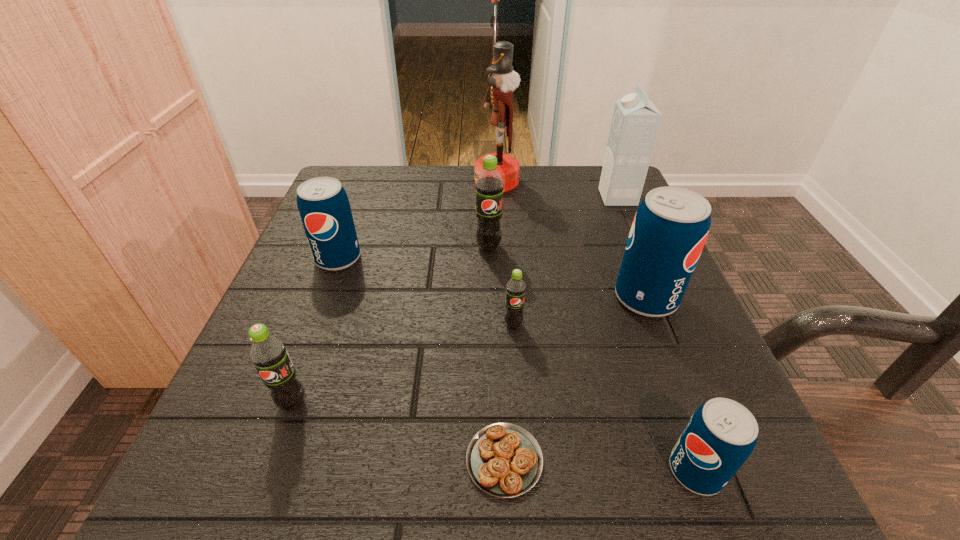
This screenshot has height=540, width=960. What are the coordinates of `pop that stands as the third closest to the farthest green soda` in the screenshot? It's located at (324, 208).

Where is `the second closest blue pop to the second tallest object`? the second closest blue pop to the second tallest object is located at coordinates (324, 208).

Identify the location of the second closest blue pop to the red nutcracker. (670, 228).

What are the coordinates of `green soda identified as the second closest to the second smallest blue pop` in the screenshot? It's located at (268, 353).

Identify which green soda is located as the third nearest to the pastry. Please provide its 2D coordinates. Your answer should be formatted as a tuple, i.e. [(x, y)], where the tuple contains the x and y coordinates of a point satisfying the conditions above.

[(489, 185)]

This screenshot has height=540, width=960. Identify the location of free space that satisfies the following two spatial constraints: 1. on the front label of the carton; 2. on the front label of the biggest green soda. (639, 247).

What are the coordinates of `free point that satisfies the following two spatial constraints: 1. on the front label of the second tallest object; 2. on the front label of the second biggest green soda` in the screenshot? It's located at (707, 403).

Where is `free space that satisfies the following two spatial constraints: 1. on the front label of the carton; 2. on the front side of the farthest blue pop`? Image resolution: width=960 pixels, height=540 pixels. free space that satisfies the following two spatial constraints: 1. on the front label of the carton; 2. on the front side of the farthest blue pop is located at coordinates (644, 259).

At what (x,y) coordinates should I click in order to perform the action: click on vacant position in the image that satisfies the following two spatial constraints: 1. on the front-facing side of the nutcracker; 2. on the front label of the nearest green soda. Please return your answer as a coordinate pair (x, y). Looking at the image, I should click on (509, 403).

At what (x,y) coordinates should I click in order to perform the action: click on free location that satisfies the following two spatial constraints: 1. on the front-facing side of the nutcracker; 2. on the front label of the second biggest green soda. Please return your answer as a coordinate pair (x, y). Looking at the image, I should click on (509, 403).